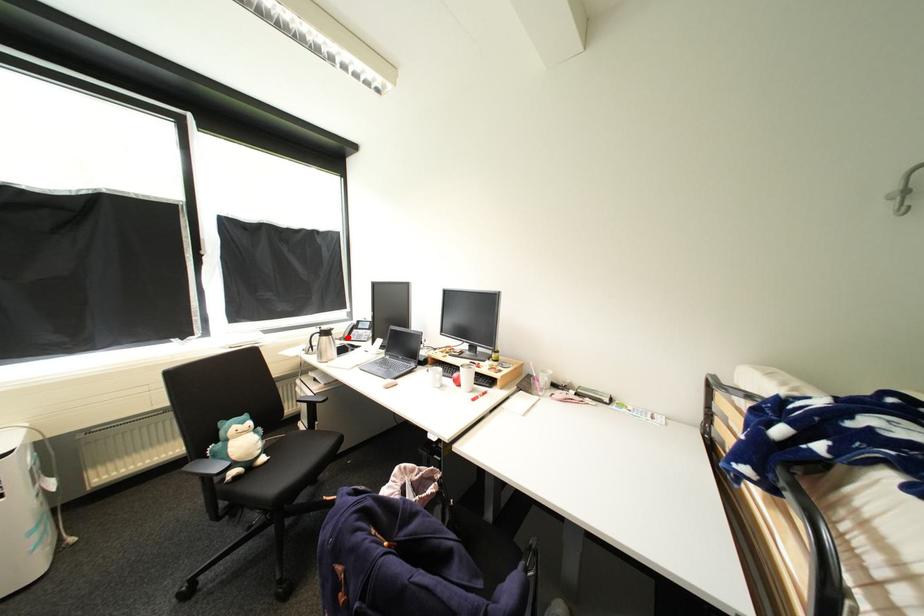
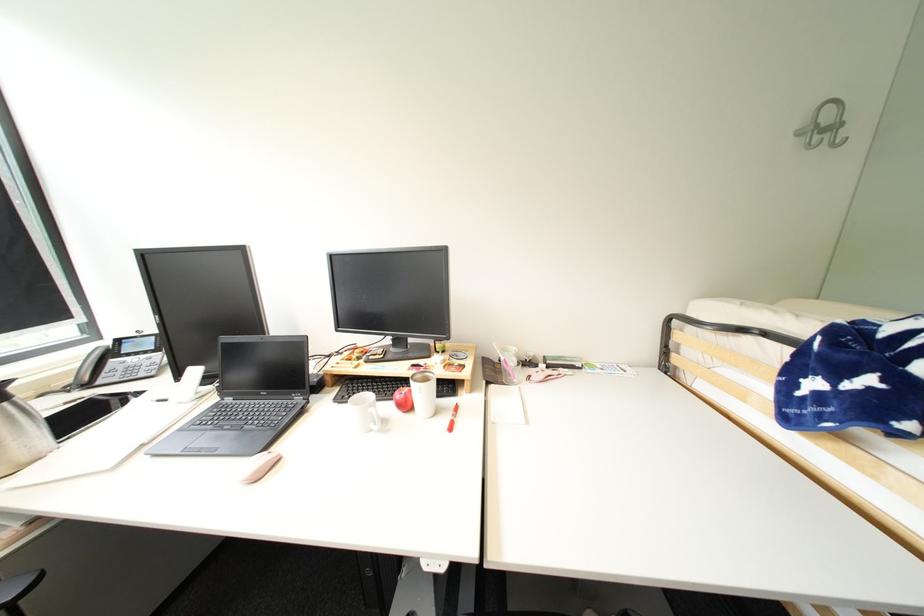
Question: I am providing you with two images of the same scene from different viewpoints. Given a red point in image1, look at the same physical point in image2. Is it:

Choices:
 (A) Closer to the viewpoint
 (B) Farther from the viewpoint

Answer: (B)